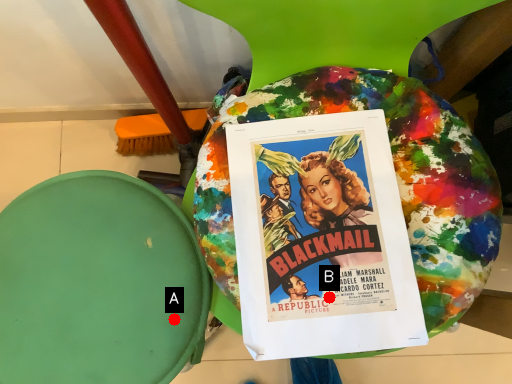
Question: Two points are circled on the image, labeled by A and B beside each circle. Among these points, which one is farthest from the camera?

Choices:
 (A) A is further
 (B) B is further

Answer: (A)